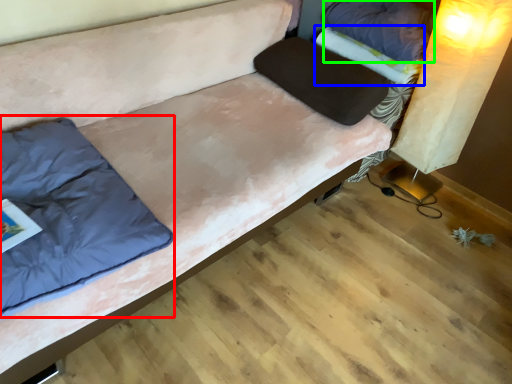
Question: Estimate the real-world distances between objects in this image. Which object is closer to pillow (highlighted by a red box), blanket (highlighted by a blue box) or pillow (highlighted by a green box)?

Choices:
 (A) blanket
 (B) pillow

Answer: (A)